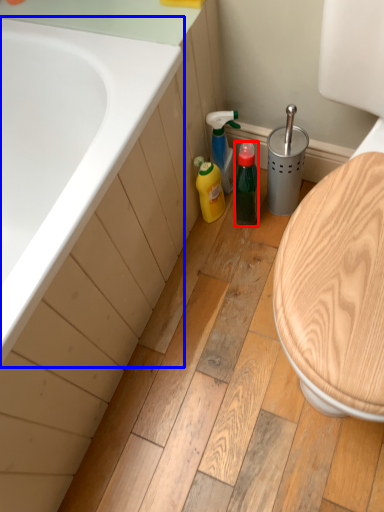
Question: Which object appears closest to the camera in this image, bottle (highlighted by a red box) or bathtub (highlighted by a blue box)?

Choices:
 (A) bottle
 (B) bathtub

Answer: (B)